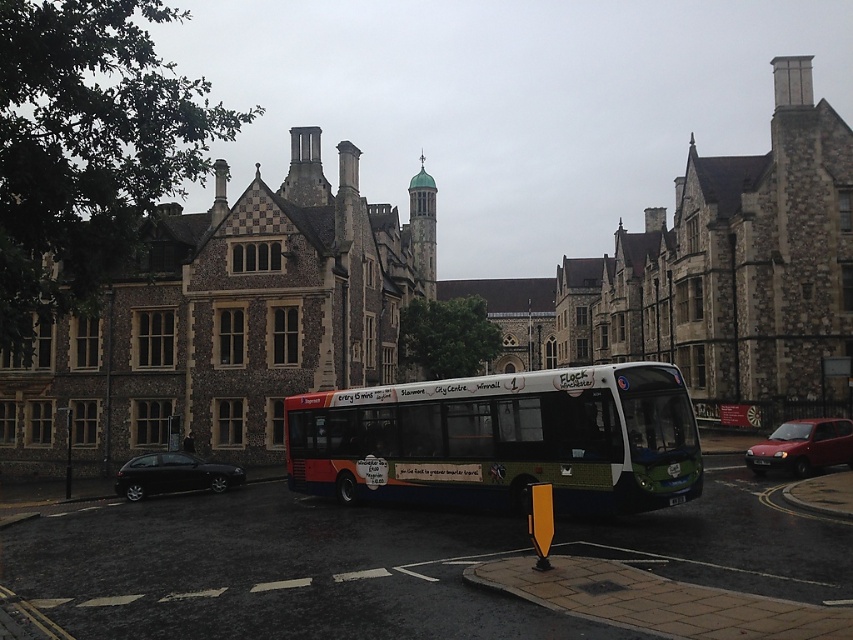
You are a passenger who just boarded the green matte bus at center. The bus has a GPS system that shows your current position as coordinates 0.688, 0.591. If the bus stop is located at coordinate 0.5, 0.5, is the bus currently ahead or behind the bus stop?

The bus is currently ahead of the bus stop because its coordinates are (503, 440), which are higher than the bus stop coordinates of (426, 320).

You are a pedestrian standing at the bus stop and want to board the green matte bus at center. Which side of the shiny red car at lower right should you walk around to catch the bus?

You should walk around the left side of the shiny red car at lower right because the green matte bus at center is positioned to the left of the shiny red car at lower right.